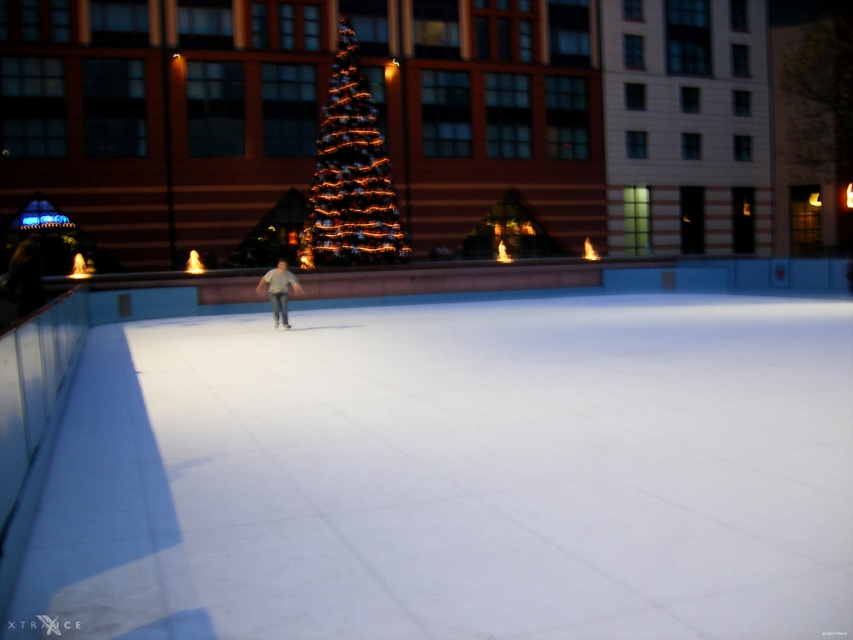
Question: Which object is closer to the camera taking this photo?

Choices:
 (A) light gray cotton shirt at center
 (B) illuminated glass christmas tree at center

Answer: (A)

Question: Where is illuminated glass christmas tree at center located in relation to light gray cotton shirt at center in the image?

Choices:
 (A) below
 (B) above

Answer: (B)

Question: Does illuminated glass christmas tree at center appear on the left side of light gray cotton shirt at center?

Choices:
 (A) no
 (B) yes

Answer: (A)

Question: Is illuminated glass christmas tree at center smaller than light gray cotton shirt at center?

Choices:
 (A) no
 (B) yes

Answer: (B)

Question: Which point is closer to the camera?

Choices:
 (A) (345, 252)
 (B) (274, 273)

Answer: (B)

Question: Among these points, which one is farthest from the camera?

Choices:
 (A) (271, 291)
 (B) (345, 42)

Answer: (B)